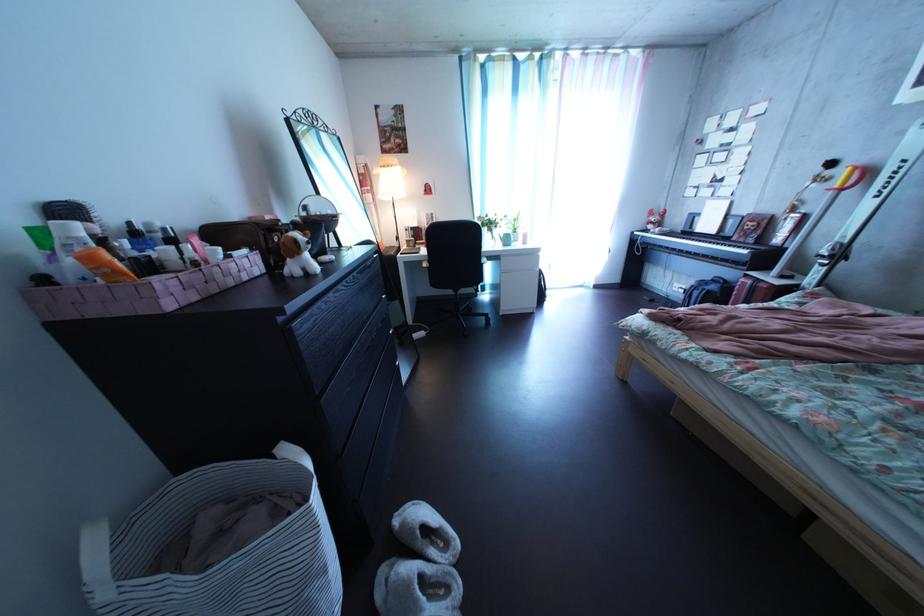
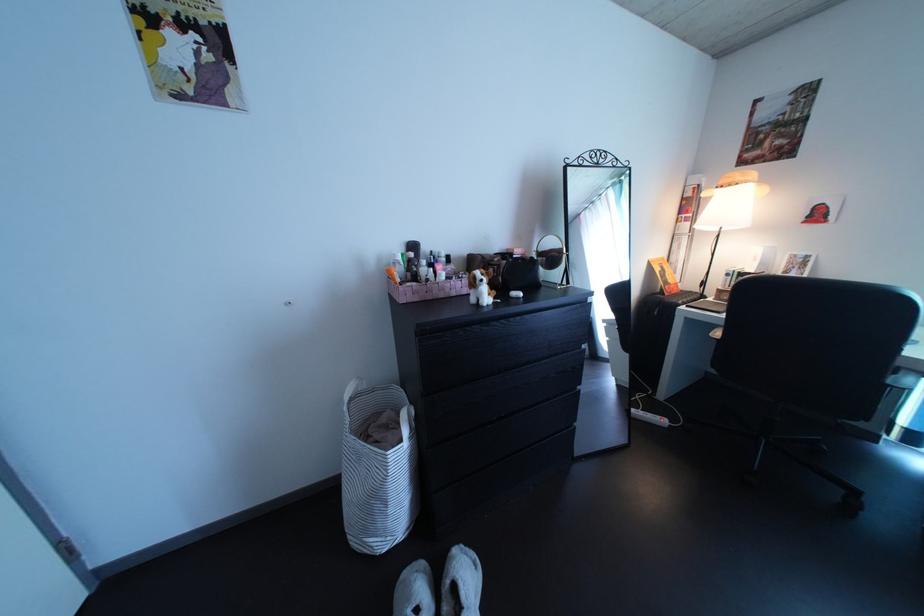
In the second image, find the point that corresponds to point (241, 264) in the first image.

(464, 286)